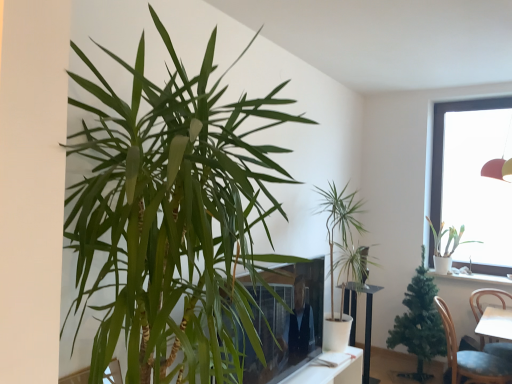
Question: In terms of size, does white ceramic pot at upper right appear bigger or smaller than green leafy plant at center, the 3th houseplant in the right-to-left sequence?

Choices:
 (A) big
 (B) small

Answer: (B)

Question: Looking at their shapes, would you say white ceramic pot at upper right is wider or thinner than green leafy plant at center, the second houseplant from the left?

Choices:
 (A) wide
 (B) thin

Answer: (B)

Question: Estimate the real-world distances between objects in this image. Which object is closer to the green leafy plant at center, positioned as the second houseplant in front-to-back order?

Choices:
 (A) white glossy round table at center
 (B) green leafy plant at left, arranged as the fourth houseplant when viewed from the back
 (C) white ceramic pot at upper right
 (D) green matte artificial tree at lower right, which is the 3th houseplant from front to back
 (E) smooth glass tv at center

Answer: (A)

Question: Considering the real-world distances, which object is farthest from the smooth glass tv at center?

Choices:
 (A) white ceramic pot at upper right
 (B) green matte artificial tree at lower right, which is the third houseplant in left-to-right order
 (C) white matte plant at upper right, placed as the 4th houseplant when sorted from left to right
 (D) white glossy round table at center
 (E) green leafy plant at left, the first houseplant when ordered from left to right

Answer: (A)